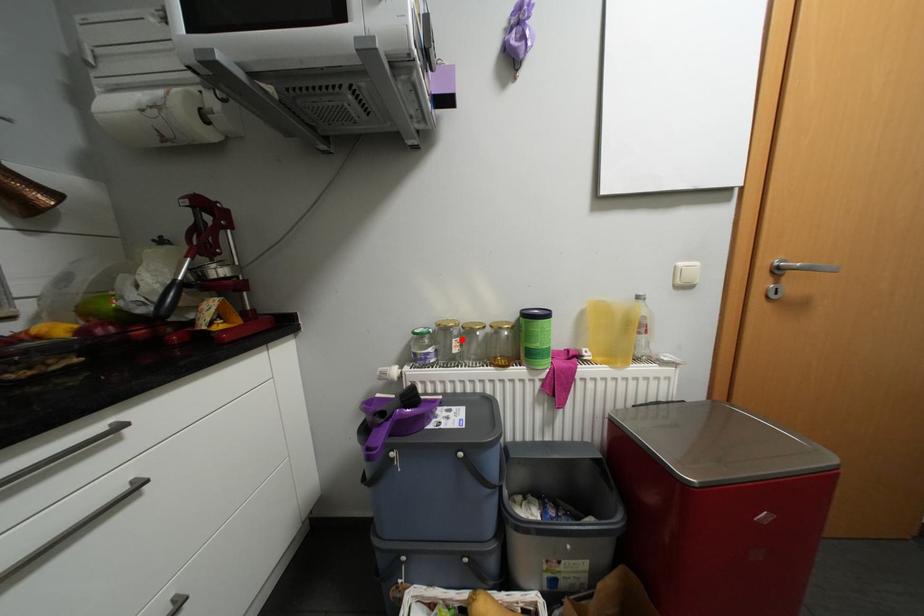
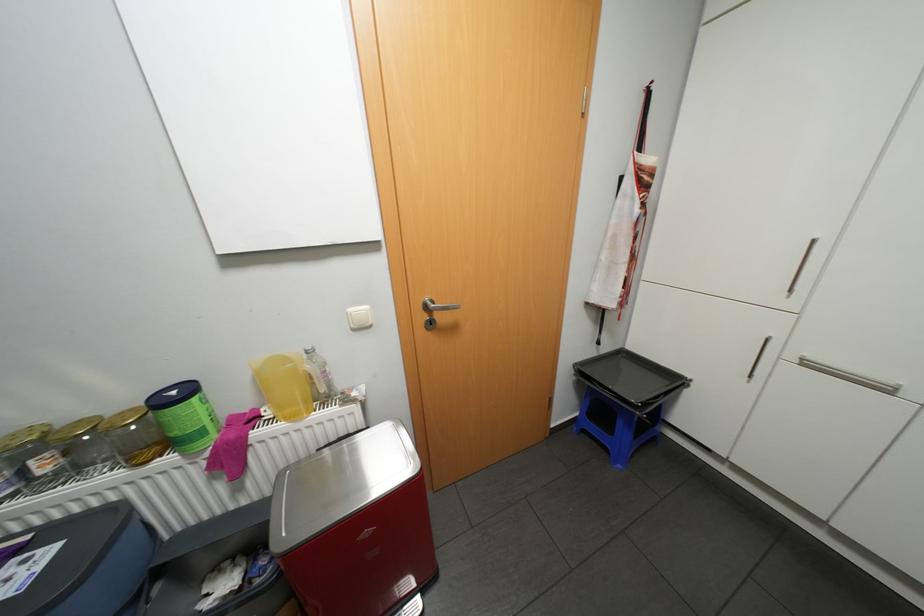
Where in the second image is the point corresponding to the highlighted location from the first image?

(39, 461)